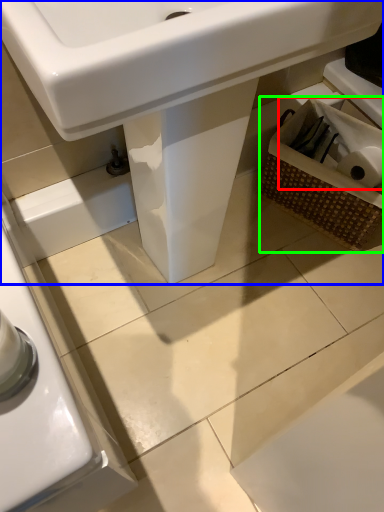
Question: Considering the real-world distances, which object is closest to toilet paper (highlighted by a red box)? sink (highlighted by a blue box) or basket (highlighted by a green box).

Choices:
 (A) sink
 (B) basket

Answer: (B)